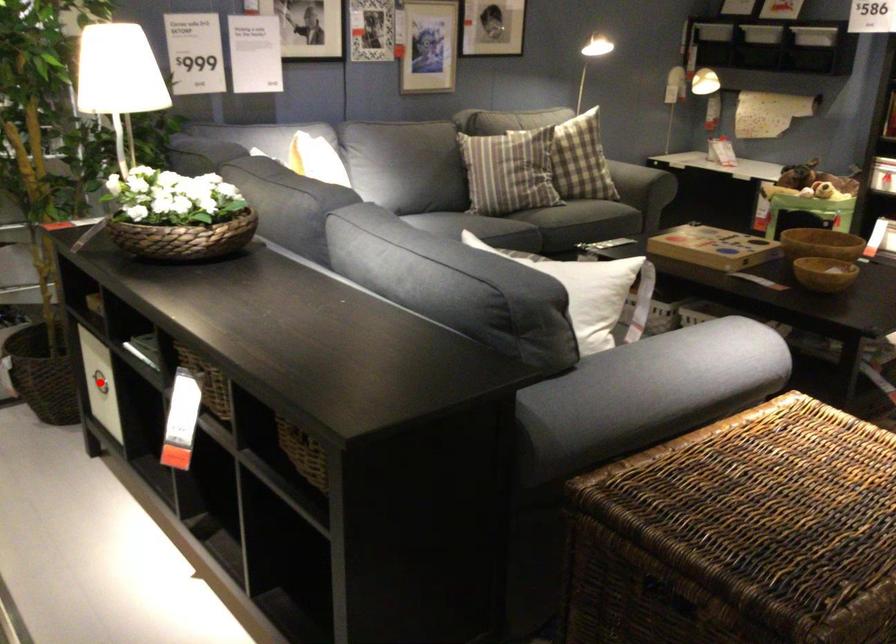
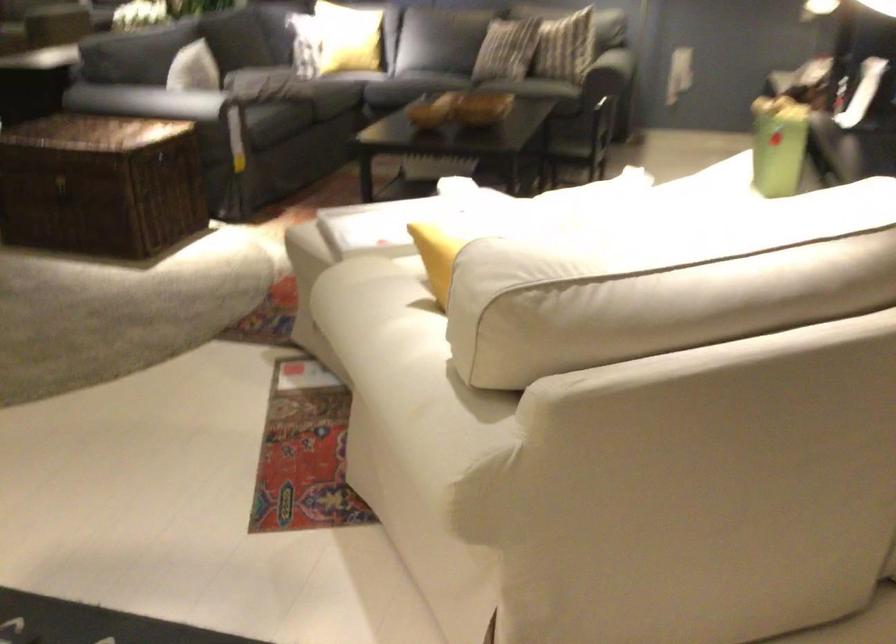
Question: I am providing you with two images of the same scene from different viewpoints. A red point is marked on the first image. At the location where the point appears in image 1, is it still visible in image 2?

Choices:
 (A) Yes
 (B) No

Answer: (B)